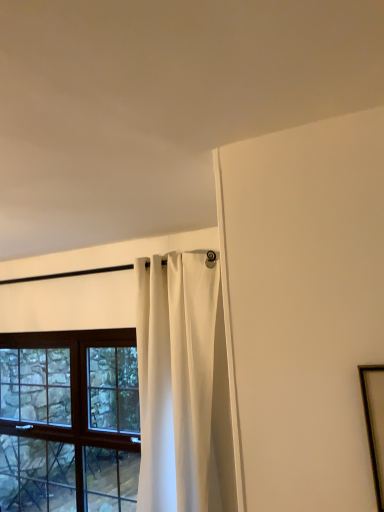
Question: Is white matte curtain at upper center oriented towards wooden-framed window at left?

Choices:
 (A) no
 (B) yes

Answer: (A)

Question: Does white matte curtain at upper center lie behind wooden-framed window at left?

Choices:
 (A) no
 (B) yes

Answer: (A)

Question: Is white matte curtain at upper center not within wooden-framed window at left?

Choices:
 (A) no
 (B) yes

Answer: (B)

Question: Is white matte curtain at upper center next to wooden-framed window at left and touching it?

Choices:
 (A) yes
 (B) no

Answer: (B)

Question: From the image's perspective, is white matte curtain at upper center located beneath wooden-framed window at left?

Choices:
 (A) yes
 (B) no

Answer: (B)

Question: In terms of size, does white matte curtain at upper center appear bigger or smaller than wooden-framed window at left?

Choices:
 (A) big
 (B) small

Answer: (B)

Question: Relative to wooden-framed window at left, is white matte curtain at upper center in front or behind?

Choices:
 (A) behind
 (B) front

Answer: (B)

Question: Do you think white matte curtain at upper center is within wooden-framed window at left, or outside of it?

Choices:
 (A) inside
 (B) outside

Answer: (B)

Question: From the image's perspective, is white matte curtain at upper center located above or below wooden-framed window at left?

Choices:
 (A) below
 (B) above

Answer: (B)

Question: Considering the relative positions of wooden-framed window at left and white matte curtain at upper center in the image provided, is wooden-framed window at left to the left or to the right of white matte curtain at upper center?

Choices:
 (A) left
 (B) right

Answer: (A)

Question: From a real-world perspective, is wooden-framed window at left positioned above or below white matte curtain at upper center?

Choices:
 (A) below
 (B) above

Answer: (A)

Question: Is wooden-framed window at left taller or shorter than white matte curtain at upper center?

Choices:
 (A) tall
 (B) short

Answer: (B)

Question: Is wooden-framed window at left spatially inside white matte curtain at upper center, or outside of it?

Choices:
 (A) inside
 (B) outside

Answer: (B)

Question: Does point (150, 399) appear closer or farther from the camera than point (370, 413)?

Choices:
 (A) farther
 (B) closer

Answer: (A)

Question: In terms of height, does white matte curtain at upper center look taller or shorter compared to wooden picture frame at right?

Choices:
 (A) short
 (B) tall

Answer: (B)